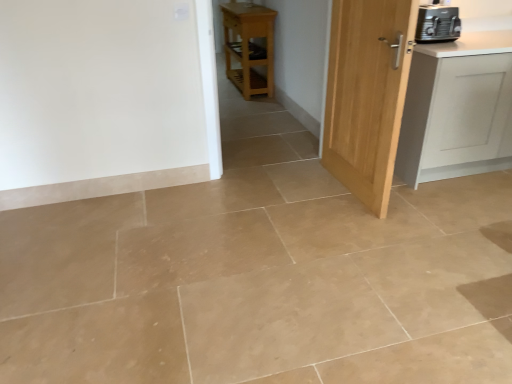
Describe the element at coordinates (249, 47) in the screenshot. The height and width of the screenshot is (384, 512). I see `light wood/matte table at center` at that location.

Where is `light wood/matte table at center`? Image resolution: width=512 pixels, height=384 pixels. light wood/matte table at center is located at coordinates (249, 47).

The width and height of the screenshot is (512, 384). I want to click on black plastic toaster at upper right, so click(437, 23).

Which object is positioned more to the right, white matte cabinet at right or light wood door at center right?

From the viewer's perspective, white matte cabinet at right appears more on the right side.

In the scene shown: Which of these two, white matte cabinet at right or light wood door at center right, stands shorter?

With less height is white matte cabinet at right.

What's the angular difference between white matte cabinet at right and light wood door at center right's facing directions?

The angular difference between white matte cabinet at right and light wood door at center right is 90 degrees.

Is white matte cabinet at right oriented away from light wood door at center right?

No, white matte cabinet at right is not facing away from light wood door at center right.

Is light wood door at center right looking in the opposite direction of white matte cabinet at right?

Absolutely, light wood door at center right is directed away from white matte cabinet at right.

Considering the relative sizes of light wood door at center right and white matte cabinet at right in the image provided, is light wood door at center right shorter than white matte cabinet at right?

Result: Incorrect, the height of light wood door at center right does not fall short of that of white matte cabinet at right.

Which is behind, point (345, 90) or point (456, 81)?

The point (345, 90) is farther.

Considering the relative sizes of white matte cabinet at right and black plastic toaster at upper right in the image provided, is white matte cabinet at right thinner than black plastic toaster at upper right?

No.

Which is correct: white matte cabinet at right is inside black plastic toaster at upper right, or outside of it?

white matte cabinet at right is located beyond the bounds of black plastic toaster at upper right.

Would you say white matte cabinet at right is to the left or to the right of black plastic toaster at upper right in the picture?

Based on their positions, white matte cabinet at right is located to the right of black plastic toaster at upper right.

Considering the sizes of light wood door at center right and black plastic toaster at upper right in the image, is light wood door at center right wider or thinner than black plastic toaster at upper right?

Considering their sizes, light wood door at center right looks slimmer than black plastic toaster at upper right.

From a real-world perspective, which object rests below the other?

light wood door at center right is physically lower.

Relative to black plastic toaster at upper right, is light wood door at center right in front or behind?

Clearly, light wood door at center right is in front of black plastic toaster at upper right.

Who is bigger, light wood door at center right or black plastic toaster at upper right?

Bigger between the two is light wood door at center right.

Looking at this image, is the surface of light wood/matte table at center in direct contact with white matte cabinet at right?

light wood/matte table at center and white matte cabinet at right are not in contact.

At what (x,y) coordinates should I click in order to perform the action: click on furniture located above the white matte cabinet at right (from the image's perspective). Please return your answer as a coordinate pair (x, y). Looking at the image, I should click on (249, 47).

Does light wood/matte table at center have a smaller size compared to white matte cabinet at right?

Yes.

In the scene shown: Is light wood/matte table at center bigger or smaller than light wood door at center right?

light wood/matte table at center is bigger than light wood door at center right.

Is light wood/matte table at center positioned beyond the bounds of light wood door at center right?

light wood/matte table at center is positioned outside light wood door at center right.

Considering the sizes of objects light wood/matte table at center and light wood door at center right in the image provided, who is shorter, light wood/matte table at center or light wood door at center right?

light wood/matte table at center is shorter.

What's the angular difference between white matte cabinet at right and light wood/matte table at center's facing directions?

90.6 degrees.

Which is closer, [462,96] or [233,76]?

Point [462,96] is positioned closer to the camera compared to point [233,76].

Based on the photo, from a real-world perspective, does white matte cabinet at right stand above light wood/matte table at center?

Yes, from a real-world perspective, white matte cabinet at right is over light wood/matte table at center

Could you tell me if white matte cabinet at right is facing light wood/matte table at center?

No, white matte cabinet at right is not aimed at light wood/matte table at center.

This screenshot has height=384, width=512. What are the coordinates of `door on the left of white matte cabinet at right` in the screenshot? It's located at coord(367,94).

Identify the location of cabinetry above the light wood door at center right (from the image's perspective). This screenshot has width=512, height=384. (456, 105).

Estimate the real-world distances between objects in this image. Which object is closer to white matte cabinet at right, light wood door at center right or light wood/matte table at center?

light wood door at center right lies closer to white matte cabinet at right than the other object.

Consider the image. Looking at the image, which one is located closer to light wood/matte table at center, white matte cabinet at right or black plastic toaster at upper right?

black plastic toaster at upper right is closer to light wood/matte table at center.

Which object lies nearer to the anchor point white matte cabinet at right, light wood/matte table at center or black plastic toaster at upper right?

black plastic toaster at upper right is closer to white matte cabinet at right.

Estimate the real-world distances between objects in this image. Which object is closer to white matte cabinet at right, light wood door at center right or black plastic toaster at upper right?

Based on the image, black plastic toaster at upper right appears to be nearer to white matte cabinet at right.

Estimate the real-world distances between objects in this image. Which object is further from light wood door at center right, white matte cabinet at right or light wood/matte table at center?

Based on the image, light wood/matte table at center appears to be further to light wood door at center right.

Looking at the image, which one is located further to white matte cabinet at right, light wood/matte table at center or light wood door at center right?

light wood/matte table at center.

From the image, which object appears to be farther from black plastic toaster at upper right, light wood/matte table at center or light wood door at center right?

light wood/matte table at center is positioned further to the anchor black plastic toaster at upper right.

From the image, which object appears to be farther from light wood/matte table at center, black plastic toaster at upper right or white matte cabinet at right?

The object further to light wood/matte table at center is white matte cabinet at right.

Where is `home appliance between light wood door at center right and light wood/matte table at center from front to back`? home appliance between light wood door at center right and light wood/matte table at center from front to back is located at coordinates [437, 23].

Where is `home appliance between light wood door at center right and white matte cabinet at right from left to right`? The width and height of the screenshot is (512, 384). home appliance between light wood door at center right and white matte cabinet at right from left to right is located at coordinates (437, 23).

The image size is (512, 384). Find the location of `cabinetry between light wood door at center right and light wood/matte table at center in the front-back direction`. cabinetry between light wood door at center right and light wood/matte table at center in the front-back direction is located at coordinates (456, 105).

Image resolution: width=512 pixels, height=384 pixels. What are the coordinates of `home appliance located between white matte cabinet at right and light wood/matte table at center in the depth direction` in the screenshot? It's located at (437, 23).